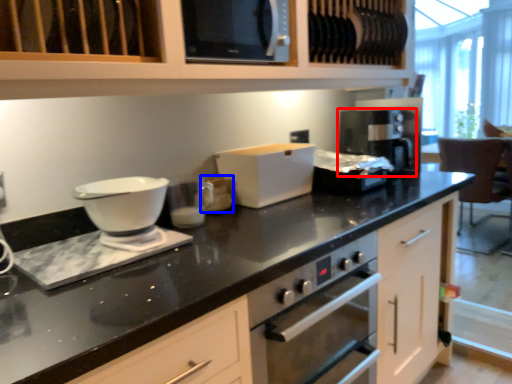
Question: Which object appears farthest to the camera in this image, coffee machine (highlighted by a red box) or appliance (highlighted by a blue box)?

Choices:
 (A) coffee machine
 (B) appliance

Answer: (A)